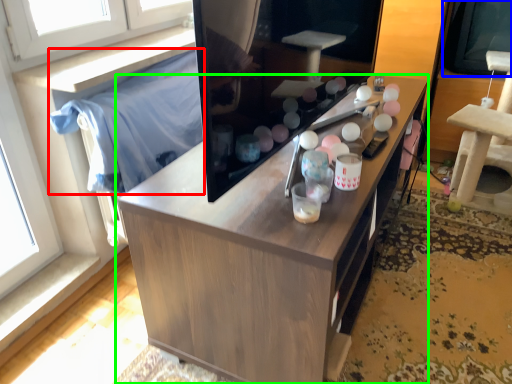
Question: Which is nearer to the cloth (highlighted by a red box)? window screen (highlighted by a blue box) or cabinetry (highlighted by a green box).

Choices:
 (A) window screen
 (B) cabinetry

Answer: (B)